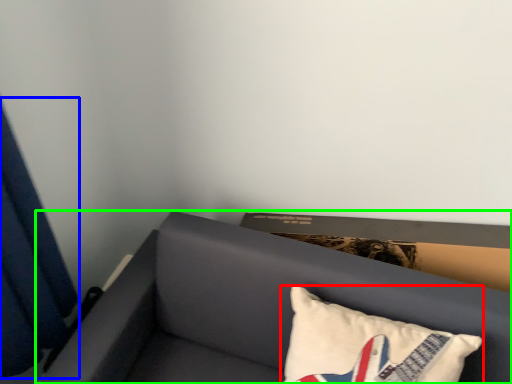
Question: Which is nearer to the pillow (highlighted by a red box)? curtain (highlighted by a blue box) or furniture (highlighted by a green box).

Choices:
 (A) curtain
 (B) furniture

Answer: (B)